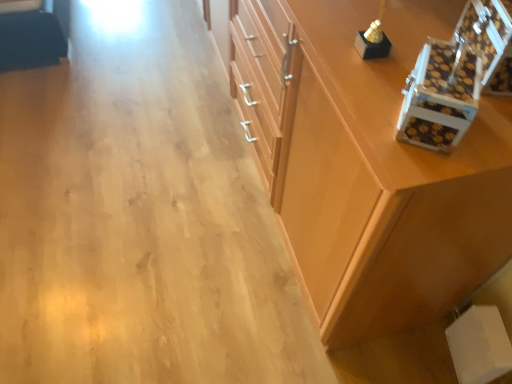
This screenshot has height=384, width=512. Describe the element at coordinates (440, 95) in the screenshot. I see `white textured box at upper right, the second box in the right-to-left sequence` at that location.

Measure the distance between point (356, 119) and camera.

Point (356, 119) is 28.07 inches away from camera.

What do you see at coordinates (490, 41) in the screenshot?
I see `brown checkered box at upper right, which is the second box from left to right` at bounding box center [490, 41].

In order to click on white textured box at upper right, marked as the 1th box in a left-to-right arrangement in this screenshot , I will do `click(440, 95)`.

Considering the sizes of objects wooden cabinet at center and white textured box at upper right, marked as the 1th box in a left-to-right arrangement, in the image provided, who is taller, wooden cabinet at center or white textured box at upper right, marked as the 1th box in a left-to-right arrangement,?

With more height is wooden cabinet at center.

Which object is wider, wooden cabinet at center or white textured box at upper right, marked as the 1th box in a left-to-right arrangement?

wooden cabinet at center is wider.

Is point (338, 233) farther from viewer compared to point (436, 127)?

Yes, it is behind point (436, 127).

Does wooden cabinet at center turn towards white textured box at upper right, marked as the 1th box in a left-to-right arrangement?

No, wooden cabinet at center is not facing towards white textured box at upper right, marked as the 1th box in a left-to-right arrangement.

Can you confirm if white textured box at upper right, the second box in the right-to-left sequence, is taller than brown checkered box at upper right, which is the second box from left to right?

No, white textured box at upper right, the second box in the right-to-left sequence, is not taller than brown checkered box at upper right, which is the second box from left to right.

In the scene shown: Are white textured box at upper right, marked as the 1th box in a left-to-right arrangement, and brown checkered box at upper right, which is the second box from left to right, beside each other?

Yes, the surface of white textured box at upper right, marked as the 1th box in a left-to-right arrangement, is in contact with brown checkered box at upper right, which is the second box from left to right.

Can you confirm if white textured box at upper right, marked as the 1th box in a left-to-right arrangement, is wider than brown checkered box at upper right, which is the second box from left to right?

No.

Based on the photo, from a real-world perspective, between white textured box at upper right, marked as the 1th box in a left-to-right arrangement, and brown checkered box at upper right, which is the second box from left to right, who is vertically lower?

white textured box at upper right, marked as the 1th box in a left-to-right arrangement.

Is brown checkered box at upper right, which is the second box from left to right, bigger than white textured box at upper right, the second box in the right-to-left sequence?

Yes, brown checkered box at upper right, which is the second box from left to right, is bigger than white textured box at upper right, the second box in the right-to-left sequence.

Is brown checkered box at upper right, which is the second box from left to right, in contact with white textured box at upper right, marked as the 1th box in a left-to-right arrangement?

Yes, brown checkered box at upper right, which is the second box from left to right, is with white textured box at upper right, marked as the 1th box in a left-to-right arrangement.

Can you confirm if brown checkered box at upper right, which is the second box from left to right, is positioned to the right of white textured box at upper right, marked as the 1th box in a left-to-right arrangement?

Yes, brown checkered box at upper right, which is the second box from left to right, is to the right of white textured box at upper right, marked as the 1th box in a left-to-right arrangement.

From a real-world perspective, is wooden cabinet at center physically below brown checkered box at upper right, which appears as the first box when viewed from the right?

Yes.

Considering the relative positions of wooden cabinet at center and brown checkered box at upper right, which is the second box from left to right, in the image provided, is wooden cabinet at center to the left or to the right of brown checkered box at upper right, which is the second box from left to right,?

From the image, it's evident that wooden cabinet at center is to the left of brown checkered box at upper right, which is the second box from left to right.

In the scene shown: Is wooden cabinet at center not close to brown checkered box at upper right, which appears as the first box when viewed from the right?

No, there isn't a large distance between wooden cabinet at center and brown checkered box at upper right, which appears as the first box when viewed from the right.

Considering the sizes of wooden cabinet at center and brown checkered box at upper right, which is the second box from left to right, in the image, is wooden cabinet at center taller or shorter than brown checkered box at upper right, which is the second box from left to right,?

Considering their sizes, wooden cabinet at center has more height than brown checkered box at upper right, which is the second box from left to right.

Between brown checkered box at upper right, which appears as the first box when viewed from the right, and wooden cabinet at center, which one appears on the right side from the viewer's perspective?

brown checkered box at upper right, which appears as the first box when viewed from the right.

From a real-world perspective, between brown checkered box at upper right, which appears as the first box when viewed from the right, and wooden cabinet at center, who is vertically higher?

brown checkered box at upper right, which appears as the first box when viewed from the right.

Which point is more distant from viewer, (502,45) or (230,31)?

Positioned behind is point (230,31).

Between point (477, 104) and point (335, 204), which one is positioned behind?

The point (335, 204) is behind.

Is white textured box at upper right, marked as the 1th box in a left-to-right arrangement, oriented away from wooden cabinet at center?

white textured box at upper right, marked as the 1th box in a left-to-right arrangement, is not turned away from wooden cabinet at center.

At what (x,y) coordinates should I click in order to perform the action: click on the 2nd box below the wooden cabinet at center (from the image's perspective). Please return your answer as a coordinate pair (x, y). The width and height of the screenshot is (512, 384). Looking at the image, I should click on (440, 95).

Where is `box on the left side of brown checkered box at upper right, which is the second box from left to right`? box on the left side of brown checkered box at upper right, which is the second box from left to right is located at coordinates (440, 95).

When comparing their distances from brown checkered box at upper right, which appears as the first box when viewed from the right, does wooden cabinet at center or white textured box at upper right, the second box in the right-to-left sequence, seem closer?

white textured box at upper right, the second box in the right-to-left sequence, is closer to brown checkered box at upper right, which appears as the first box when viewed from the right.

Looking at the image, which one is located closer to wooden cabinet at center, brown checkered box at upper right, which is the second box from left to right, or white textured box at upper right, the second box in the right-to-left sequence?

white textured box at upper right, the second box in the right-to-left sequence, is closer to wooden cabinet at center.

Based on their spatial positions, is white textured box at upper right, marked as the 1th box in a left-to-right arrangement, or brown checkered box at upper right, which is the second box from left to right, further from wooden cabinet at center?

brown checkered box at upper right, which is the second box from left to right, is further to wooden cabinet at center.

Based on their spatial positions, is brown checkered box at upper right, which appears as the first box when viewed from the right, or wooden cabinet at center closer to white textured box at upper right, the second box in the right-to-left sequence?

Among the two, brown checkered box at upper right, which appears as the first box when viewed from the right, is located nearer to white textured box at upper right, the second box in the right-to-left sequence.

From the image, which object appears to be farther from white textured box at upper right, marked as the 1th box in a left-to-right arrangement, wooden cabinet at center or brown checkered box at upper right, which appears as the first box when viewed from the right?

The object further to white textured box at upper right, marked as the 1th box in a left-to-right arrangement, is wooden cabinet at center.

Considering their positions, is white textured box at upper right, the second box in the right-to-left sequence, positioned further to brown checkered box at upper right, which appears as the first box when viewed from the right, than wooden cabinet at center?

wooden cabinet at center.

Identify the location of box that lies between wooden cabinet at center and white textured box at upper right, marked as the 1th box in a left-to-right arrangement, from top to bottom. The height and width of the screenshot is (384, 512). tap(490, 41).